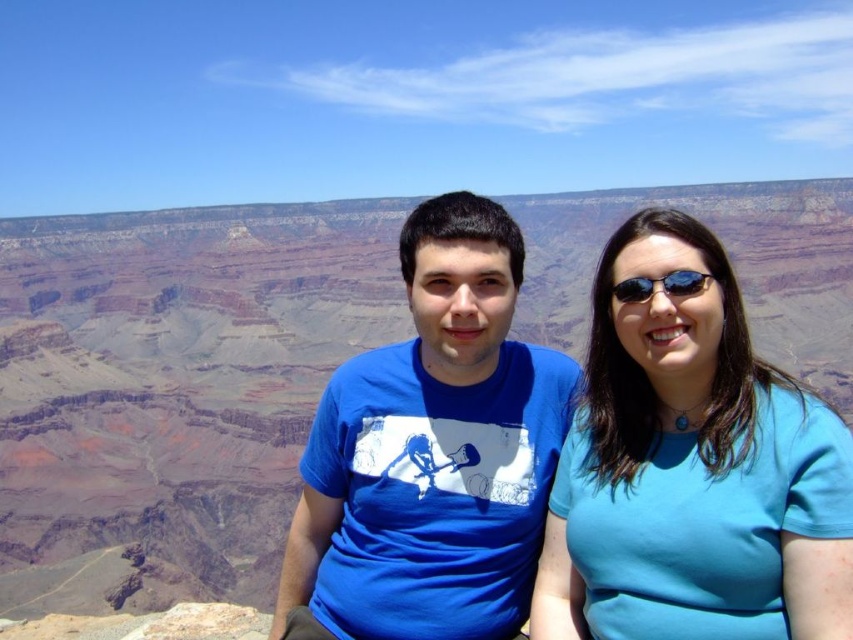
Based on the photo, is blue fabric shirt at center wider than black reflective sunglasses at upper right?

Yes.

Can you confirm if blue fabric shirt at center is positioned above black reflective sunglasses at upper right?

Incorrect, blue fabric shirt at center is not positioned above black reflective sunglasses at upper right.

Is point (688, 320) behind point (633, 285)?

No, it is not.

The image size is (853, 640). I want to click on blue fabric shirt at center, so click(x=692, y=468).

Does blue fabric shirt at center have a larger size compared to blue cotton t-shirt at center?

Actually, blue fabric shirt at center might be smaller than blue cotton t-shirt at center.

Identify the location of blue fabric shirt at center. (692, 468).

Where is `blue fabric shirt at center`? blue fabric shirt at center is located at coordinates (692, 468).

Is reddish-brown rock formation at center wider than blue cotton t-shirt at center?

Yes.

Which of these two, reddish-brown rock formation at center or blue cotton t-shirt at center, stands taller?

With more height is reddish-brown rock formation at center.

Is point (560, 298) behind point (337, 548)?

Yes, point (560, 298) is behind point (337, 548).

At what (x,y) coordinates should I click in order to perform the action: click on reddish-brown rock formation at center. Please return your answer as a coordinate pair (x, y). The height and width of the screenshot is (640, 853). Looking at the image, I should click on (172, 392).